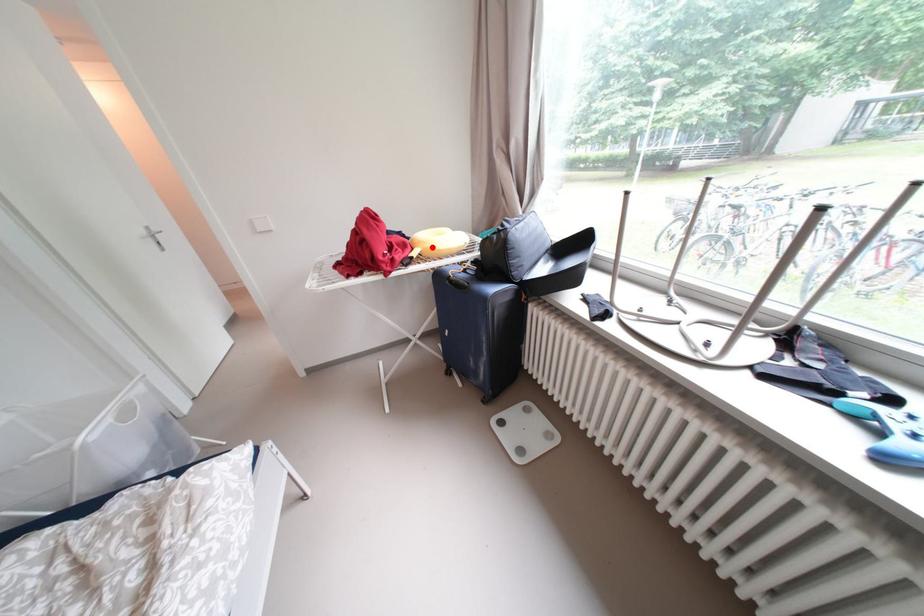
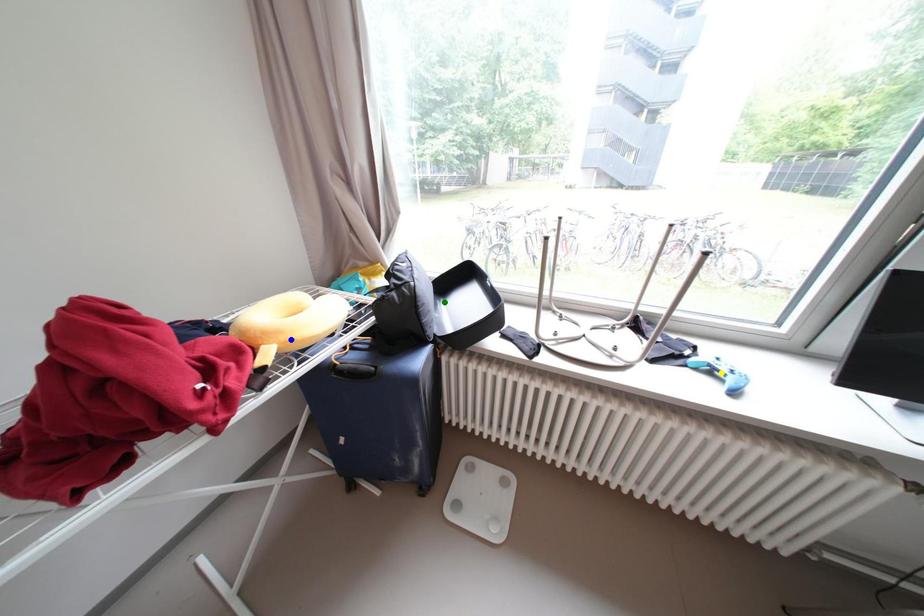
Question: I am providing you with two images of the same scene from different viewpoints. A red point is marked on the first image. You are given multiple points on the second image. Which mark in image 2 goes with the point in image 1?

Choices:
 (A) green point
 (B) yellow point
 (C) blue point

Answer: (C)